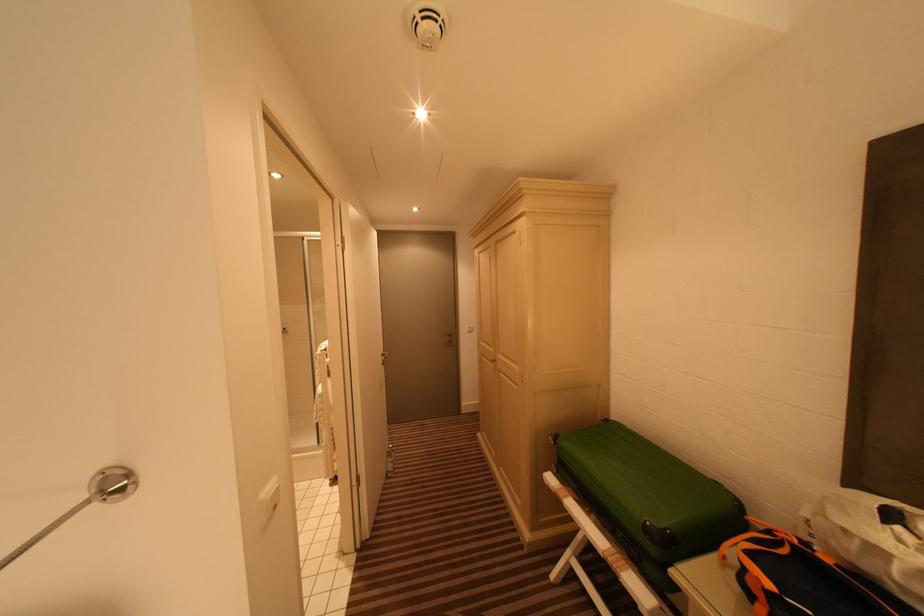
Locate an element on the screen. The image size is (924, 616). plastic water bottle is located at coordinates (390, 461).